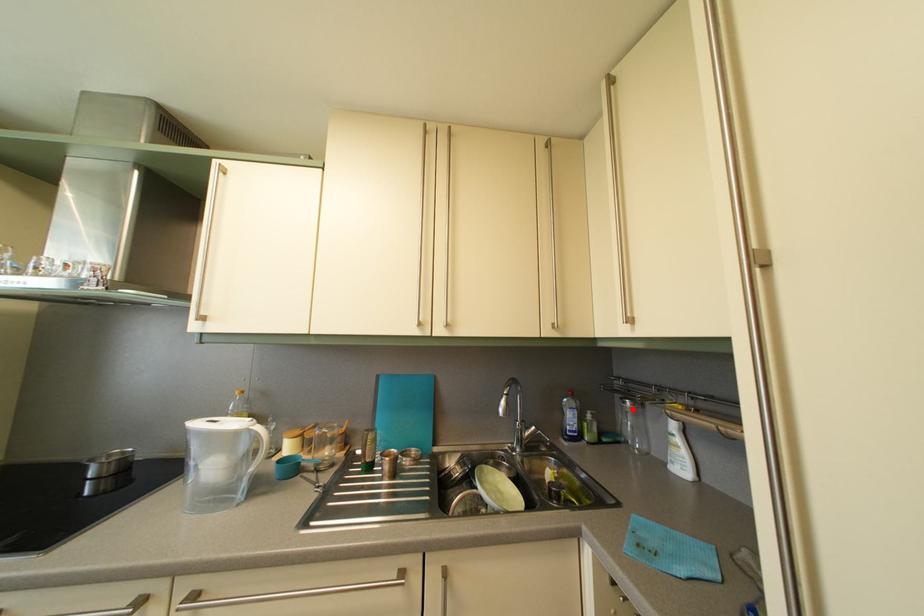
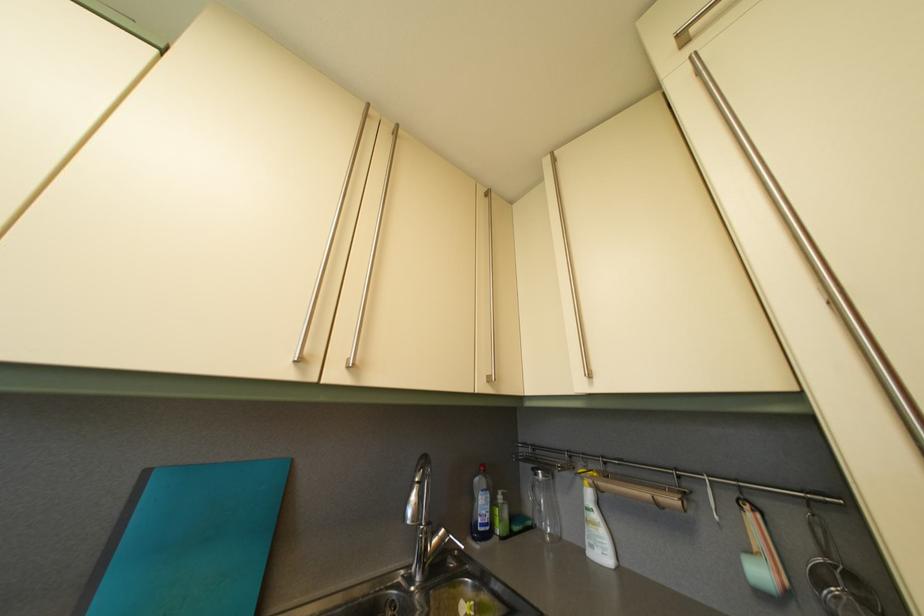
The point at the highlighted location is marked in the first image. Where is the corresponding point in the second image?

(544, 482)